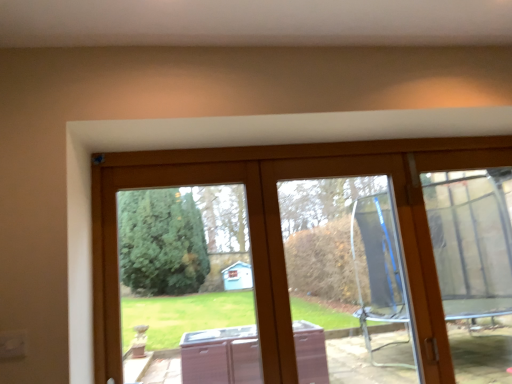
Question: Is transparent glass door at center inside clear plastic screen door at right?

Choices:
 (A) no
 (B) yes

Answer: (A)

Question: Considering the relative sizes of clear plastic screen door at right and transparent glass door at center in the image provided, is clear plastic screen door at right taller than transparent glass door at center?

Choices:
 (A) yes
 (B) no

Answer: (A)

Question: Is clear plastic screen door at right positioned behind transparent glass door at center?

Choices:
 (A) yes
 (B) no

Answer: (A)

Question: From a real-world perspective, does clear plastic screen door at right stand above transparent glass door at center?

Choices:
 (A) no
 (B) yes

Answer: (B)

Question: From the image's perspective, would you say clear plastic screen door at right is positioned over transparent glass door at center?

Choices:
 (A) no
 (B) yes

Answer: (B)

Question: Does clear plastic screen door at right have a smaller size compared to transparent glass door at center?

Choices:
 (A) yes
 (B) no

Answer: (A)

Question: Is clear glass door at center facing away from transparent glass door at center?

Choices:
 (A) yes
 (B) no

Answer: (A)

Question: Is clear glass door at center further to the viewer compared to transparent glass door at center?

Choices:
 (A) no
 (B) yes

Answer: (B)

Question: From the image's perspective, is clear glass door at center over transparent glass door at center?

Choices:
 (A) no
 (B) yes

Answer: (B)

Question: Would you say clear glass door at center is outside transparent glass door at center?

Choices:
 (A) no
 (B) yes

Answer: (A)

Question: Considering the relative sizes of clear glass door at center and transparent glass door at center in the image provided, is clear glass door at center shorter than transparent glass door at center?

Choices:
 (A) no
 (B) yes

Answer: (A)

Question: Does clear glass door at center turn towards transparent glass door at center?

Choices:
 (A) no
 (B) yes

Answer: (B)

Question: Does transparent glass door at center appear on the left side of clear glass door at center?

Choices:
 (A) no
 (B) yes

Answer: (B)